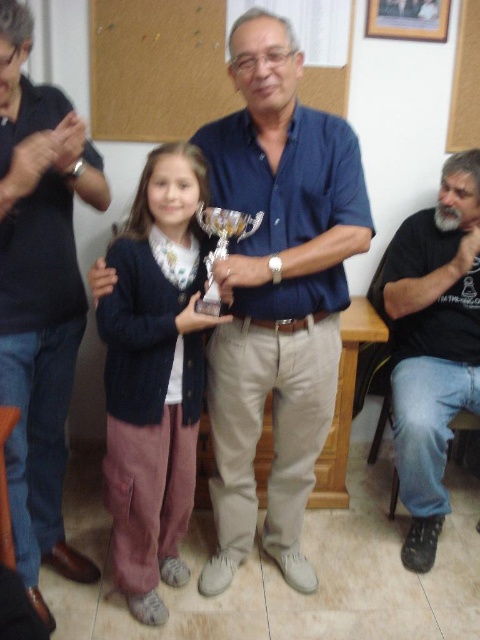
Question: Which point is closer to the camera?

Choices:
 (A) (72, 224)
 (B) (131, 349)
 (C) (216, 230)
 (D) (399, 16)

Answer: (C)

Question: Among these points, which one is nearest to the camera?

Choices:
 (A) (433, 33)
 (B) (189, 442)
 (C) (74, 310)

Answer: (C)

Question: Does brushed metal trophy at center appear on the right side of gold metallic trophy at center?

Choices:
 (A) yes
 (B) no

Answer: (B)

Question: Can you confirm if blue cotton shirt at center is thinner than brushed metal trophy at center?

Choices:
 (A) no
 (B) yes

Answer: (A)

Question: Which object is positioned closest to the gold metallic trophy at center?

Choices:
 (A) black cotton shirt at lower right
 (B) knitted sweater at center
 (C) blue cotton shirt at center

Answer: (C)

Question: Does wooden frame at upper center have a smaller size compared to gold metallic trophy at center?

Choices:
 (A) yes
 (B) no

Answer: (A)